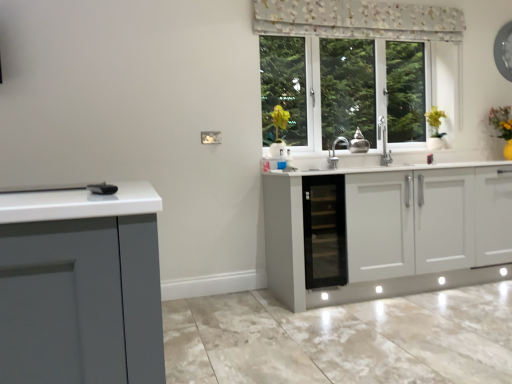
Question: Is floral fabric curtain at upper center thinner than black glass cabinet at center?

Choices:
 (A) no
 (B) yes

Answer: (B)

Question: From a real-world perspective, is floral fabric curtain at upper center under black glass cabinet at center?

Choices:
 (A) no
 (B) yes

Answer: (A)

Question: Can we say floral fabric curtain at upper center lies outside black glass cabinet at center?

Choices:
 (A) yes
 (B) no

Answer: (A)

Question: From the image's perspective, is floral fabric curtain at upper center on top of black glass cabinet at center?

Choices:
 (A) yes
 (B) no

Answer: (A)

Question: Is floral fabric curtain at upper center placed right next to black glass cabinet at center?

Choices:
 (A) no
 (B) yes

Answer: (A)

Question: Is floral fabric curtain at upper center taller than black glass cabinet at center?

Choices:
 (A) yes
 (B) no

Answer: (B)

Question: Are floral fabric curtain at upper center and yellow matte plant at upper right located far from each other?

Choices:
 (A) no
 (B) yes

Answer: (B)

Question: Is the depth of floral fabric curtain at upper center greater than that of yellow matte plant at upper right?

Choices:
 (A) no
 (B) yes

Answer: (A)

Question: Is floral fabric curtain at upper center closer to the viewer compared to yellow matte plant at upper right?

Choices:
 (A) yes
 (B) no

Answer: (A)

Question: Is floral fabric curtain at upper center not inside yellow matte plant at upper right?

Choices:
 (A) no
 (B) yes

Answer: (B)

Question: Could you tell me if floral fabric curtain at upper center is turned towards yellow matte plant at upper right?

Choices:
 (A) yes
 (B) no

Answer: (B)

Question: Is yellow matte plant at upper right located within floral fabric curtain at upper center?

Choices:
 (A) yes
 (B) no

Answer: (B)

Question: Is black glass cabinet at center shorter than yellow matte plant at upper right?

Choices:
 (A) yes
 (B) no

Answer: (B)